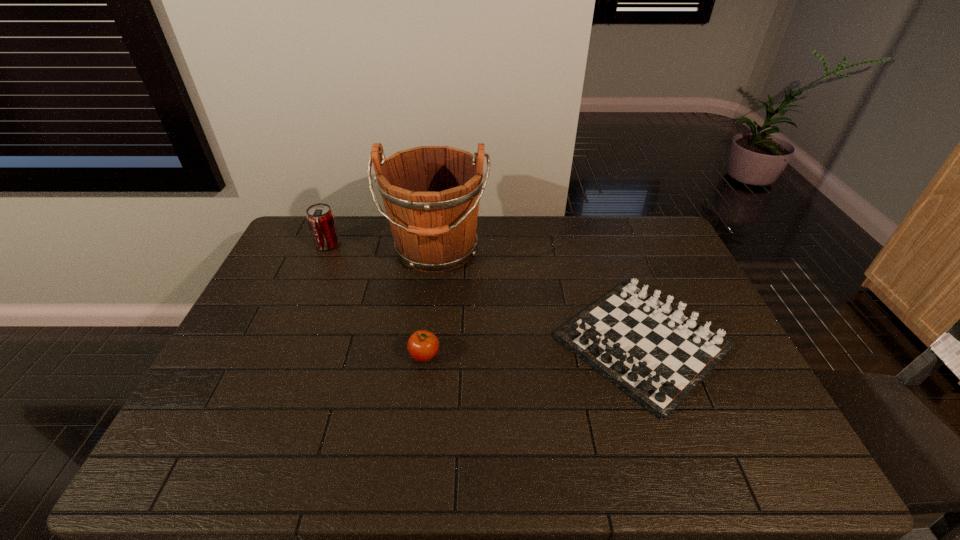
Identify the location of free spot between the pop soda and the apple. pyautogui.click(x=376, y=300).

Find the location of a particular element. This screenshot has width=960, height=540. blank region between the bucket and the third tallest object is located at coordinates (430, 303).

I want to click on free space between the leftmost object and the rightmost object, so click(485, 293).

Find the location of `empty space that is in between the tallest object and the apple`. empty space that is in between the tallest object and the apple is located at coordinates (430, 303).

Locate an element on the screen. This screenshot has width=960, height=540. vacant area that lies between the rightmost object and the second tallest object is located at coordinates coord(485,293).

I want to click on vacant point located between the pop soda and the rightmost object, so click(x=485, y=293).

You are a GUI agent. You are given a task and a screenshot of the screen. Output one action in this format:
    pyautogui.click(x=<x>, y=<y>)
    Task: Click on the free space between the bucket and the third tallest object
    This screenshot has width=960, height=540.
    Given the screenshot: What is the action you would take?
    pyautogui.click(x=430, y=303)

The height and width of the screenshot is (540, 960). Find the location of `free space between the tallest object and the rightmost object`. free space between the tallest object and the rightmost object is located at coordinates (540, 296).

Locate an element on the screen. The image size is (960, 540). empty location between the third tallest object and the rightmost object is located at coordinates (534, 349).

At what (x,y) coordinates should I click in order to perform the action: click on vacant space that's between the apple and the third shortest object. Please return your answer as a coordinate pair (x, y). Looking at the image, I should click on (376, 300).